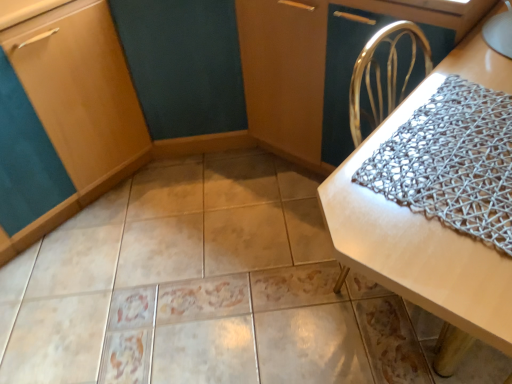
Question: In terms of height, does beige glossy tile at center look taller or shorter compared to matte wood cabinet at lower left?

Choices:
 (A) tall
 (B) short

Answer: (B)

Question: From a real-world perspective, is beige glossy tile at center positioned above or below matte wood cabinet at lower left?

Choices:
 (A) below
 (B) above

Answer: (A)

Question: Estimate the real-world distances between objects in this image. Which object is closer to the white woven placemat at center?

Choices:
 (A) beige glossy tile at center
 (B) metallic woven placemat at upper right
 (C) silver mesh blanket at right
 (D) matte wood cabinet at lower left

Answer: (C)

Question: Considering the real-world distances, which object is farthest from the matte wood cabinet at lower left?

Choices:
 (A) beige glossy tile at center
 (B) white woven placemat at center
 (C) metallic woven placemat at upper right
 (D) silver mesh blanket at right

Answer: (D)